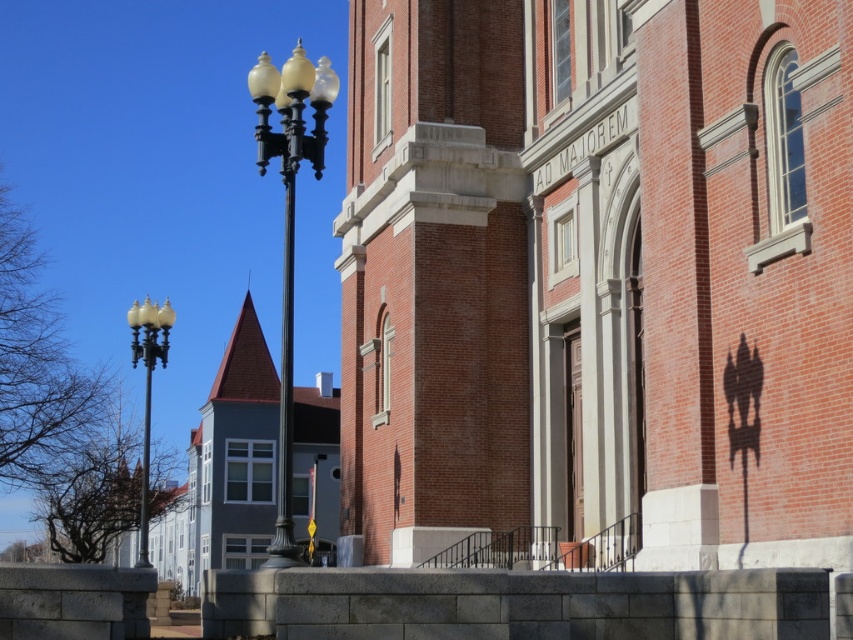
Question: Can you confirm if black polished metal streetlight at center-left is thinner than matte black lamp post at left?

Choices:
 (A) no
 (B) yes

Answer: (B)

Question: Estimate the real-world distances between objects in this image. Which object is closer to the black metal pole at left?

Choices:
 (A) black polished metal streetlight at center-left
 (B) polished brass streetlight at left
 (C) matte black lamp post at left

Answer: (C)

Question: Which point is closer to the camera?

Choices:
 (A) matte black lamp post at left
 (B) black metal pole at left
 (C) black polished metal streetlight at center-left

Answer: (C)

Question: Observing the image, what is the correct spatial positioning of polished brass streetlight at left in reference to black metal pole at left?

Choices:
 (A) left
 (B) right

Answer: (B)

Question: Which object is farther from the camera taking this photo?

Choices:
 (A) polished brass streetlight at left
 (B) matte black lamp post at left
 (C) black polished metal streetlight at center-left
 (D) black metal pole at left

Answer: (B)

Question: Is black polished metal streetlight at center-left closer to the viewer compared to black metal pole at left?

Choices:
 (A) yes
 (B) no

Answer: (A)